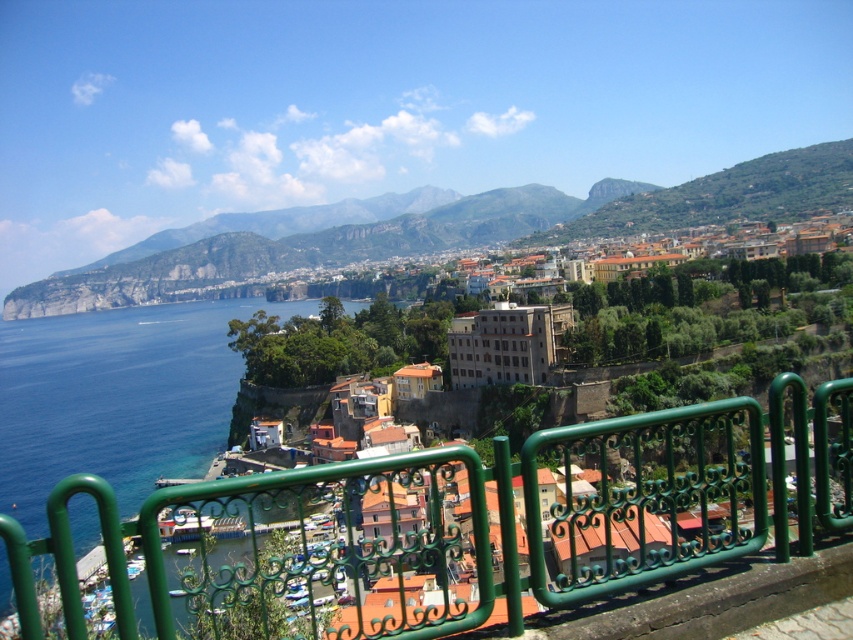
Question: Does green wrought iron fence at center appear under blue water at lower left?

Choices:
 (A) yes
 (B) no

Answer: (A)

Question: Can you confirm if green wrought iron fence at center is positioned to the right of blue water at lower left?

Choices:
 (A) yes
 (B) no

Answer: (A)

Question: Which of the following is the farthest from the observer?

Choices:
 (A) green wrought iron fence at center
 (B) blue water at lower left

Answer: (B)

Question: Is green wrought iron fence at center positioned before blue water at lower left?

Choices:
 (A) yes
 (B) no

Answer: (A)

Question: Which object appears closest to the camera in this image?

Choices:
 (A) green wrought iron fence at center
 (B) blue water at lower left

Answer: (A)